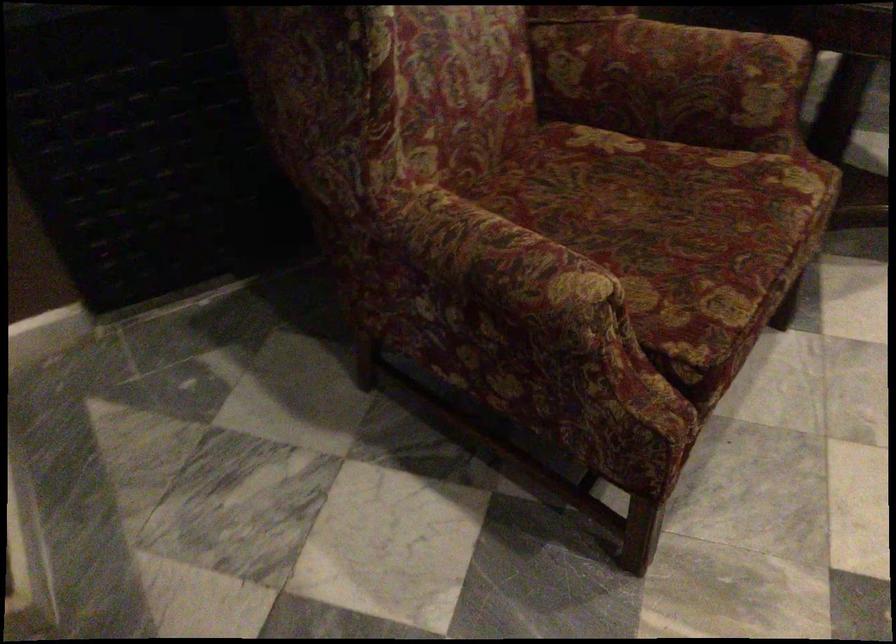
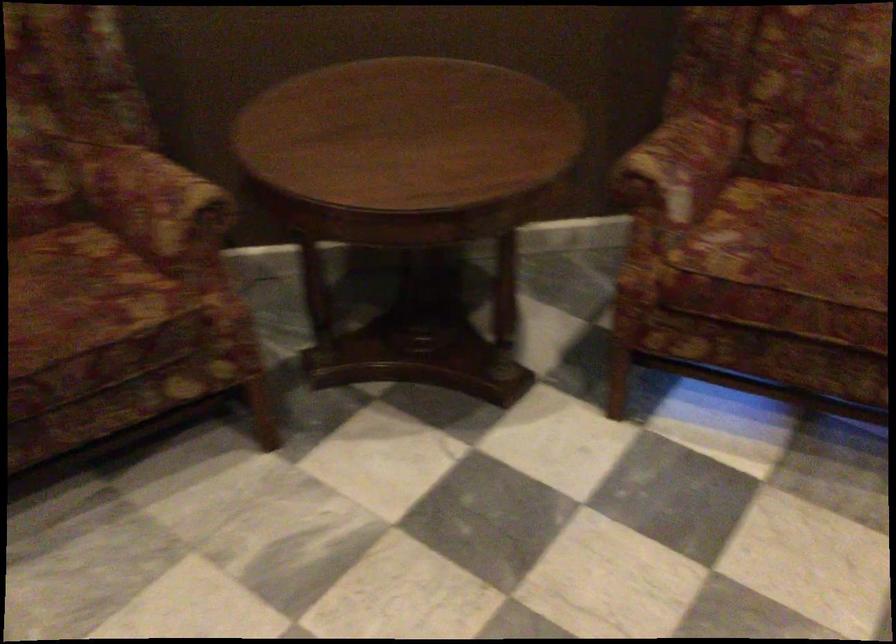
Question: What movement of the cameraman would produce the second image?

Choices:
 (A) Left
 (B) Right
 (C) Forward
 (D) Backward

Answer: (B)